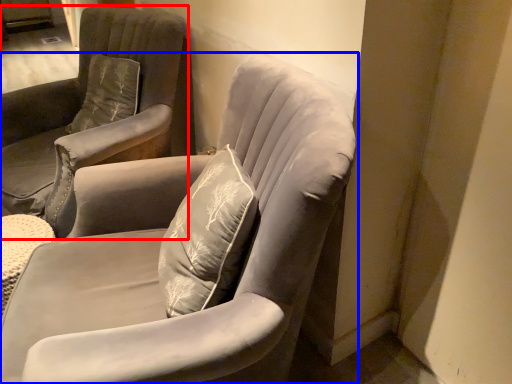
Question: Which point is further to the camera, chair (highlighted by a red box) or chair (highlighted by a blue box)?

Choices:
 (A) chair
 (B) chair

Answer: (A)